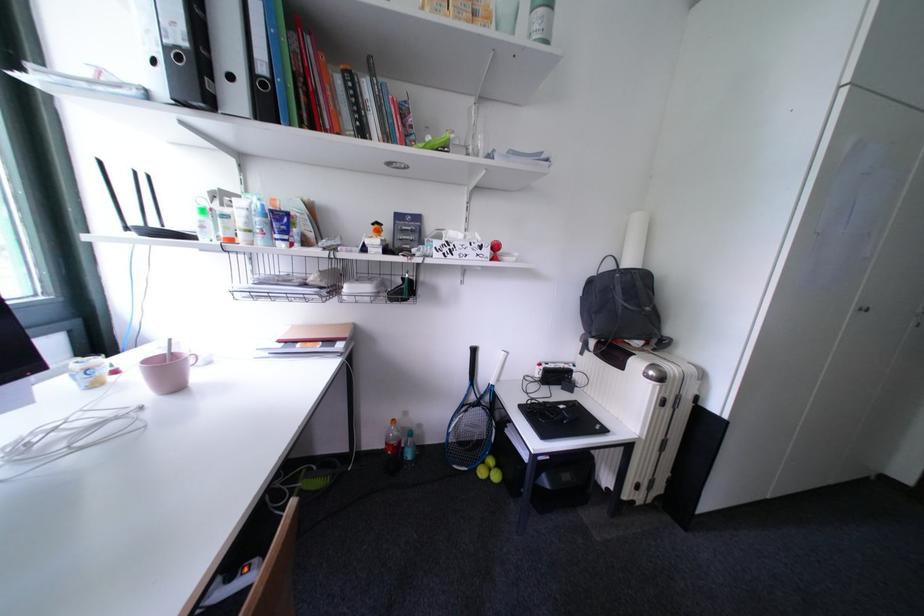
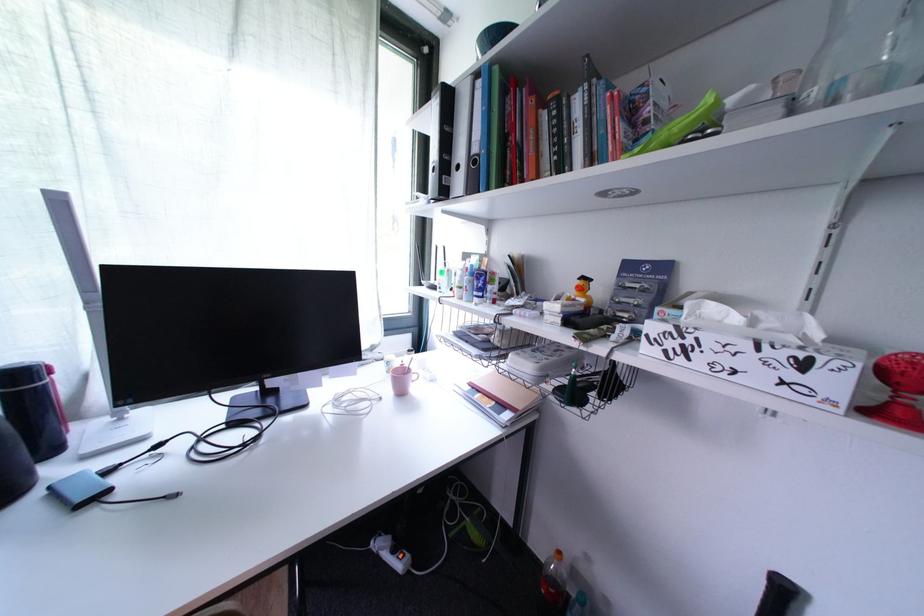
Question: The camera is either moving clockwise (left) or counter-clockwise (right) around the object. The first image is from the beginning of the video and the second image is from the end. Is the camera moving left or right when shooting the video?

Choices:
 (A) Left
 (B) Right

Answer: (B)